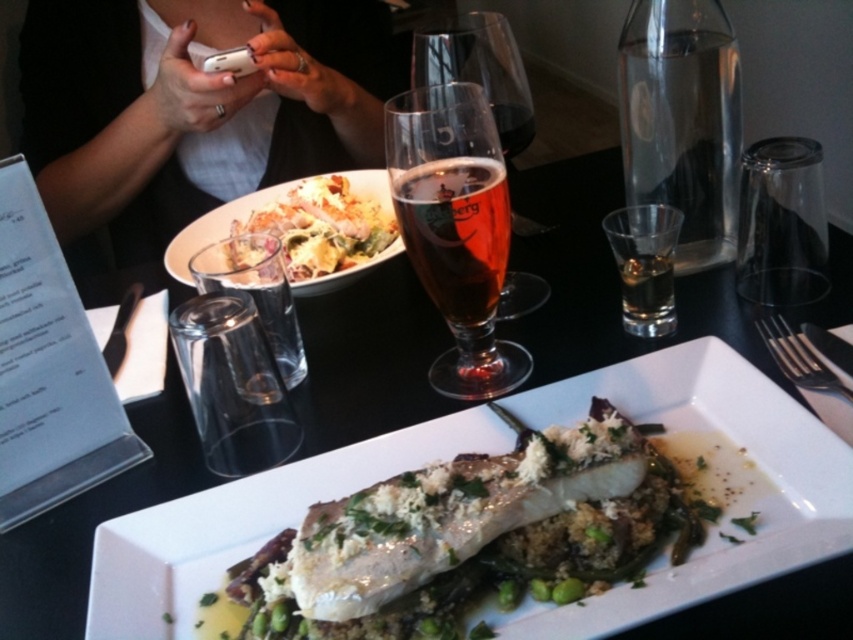
Is point (71, 456) more distant than point (461, 291)?

That is True.

Between white paper menu at left and amber glass beer at center, which one has less height?

Standing shorter between the two is amber glass beer at center.

Does point (65, 468) come closer to viewer compared to point (421, 211)?

No, it is behind (421, 211).

In order to click on white paper menu at left in this screenshot , I will do `click(48, 369)`.

Between translucent glass beer at center and amber glass beer at center, which one has less height?

amber glass beer at center is shorter.

Does translucent glass beer at center have a smaller size compared to amber glass beer at center?

Incorrect, translucent glass beer at center is not smaller in size than amber glass beer at center.

Does point (482, 280) come farther from viewer compared to point (503, 262)?

No, it is in front of (503, 262).

Image resolution: width=853 pixels, height=640 pixels. Find the location of `translucent glass beer at center`. translucent glass beer at center is located at coordinates (456, 228).

Who is more distant from viewer, (442,496) or (300,268)?

Point (300,268)

Is white crumbly fish at center bigger than white creamy salad at upper center?

Incorrect, white crumbly fish at center is not larger than white creamy salad at upper center.

You are a GUI agent. You are given a task and a screenshot of the screen. Output one action in this format:
    pyautogui.click(x=<x>, y=<y>)
    Task: Click on the white crumbly fish at center
    This screenshot has width=853, height=640.
    Given the screenshot: What is the action you would take?
    pyautogui.click(x=469, y=536)